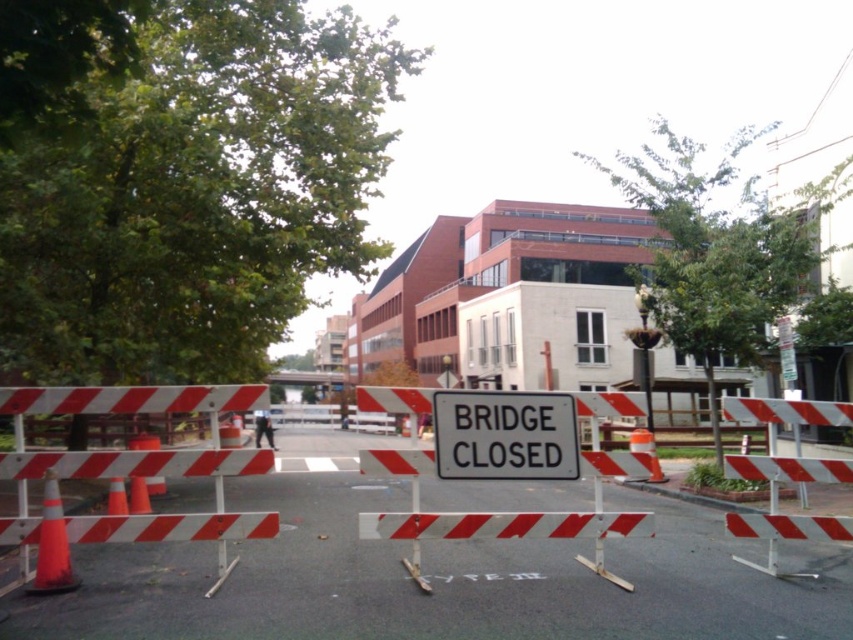
Identify the location of white striped barricade at center. The image size is (853, 640). (138, 465).

Who is positioned more to the right, white striped barricade at center or orange reflective cone at center-left?

white striped barricade at center is more to the right.

Describe the element at coordinates (138, 465) in the screenshot. This screenshot has height=640, width=853. I see `white striped barricade at center` at that location.

At what (x,y) coordinates should I click in order to perform the action: click on white striped barricade at center. Please return your answer as a coordinate pair (x, y). Image resolution: width=853 pixels, height=640 pixels. Looking at the image, I should click on (138, 465).

Is white plastic sign at center closer to the viewer compared to white metal barricade at center?

That is True.

Can you confirm if white plastic sign at center is positioned to the left of white metal barricade at center?

Yes, white plastic sign at center is to the left of white metal barricade at center.

Which is in front, point (532, 461) or point (850, 406)?

Positioned in front is point (532, 461).

Where is `white plastic sign at center`? The height and width of the screenshot is (640, 853). white plastic sign at center is located at coordinates (505, 435).

Can you confirm if white striped barricade at center is positioned above white plastic sign at center?

Yes.

Can you confirm if white striped barricade at center is taller than white plastic sign at center?

No, white striped barricade at center is not taller than white plastic sign at center.

Describe the element at coordinates (138, 465) in the screenshot. Image resolution: width=853 pixels, height=640 pixels. I see `white striped barricade at center` at that location.

You are a GUI agent. You are given a task and a screenshot of the screen. Output one action in this format:
    pyautogui.click(x=<x>, y=<y>)
    Task: Click on the white striped barricade at center
    The image size is (853, 640).
    Given the screenshot: What is the action you would take?
    pyautogui.click(x=138, y=465)